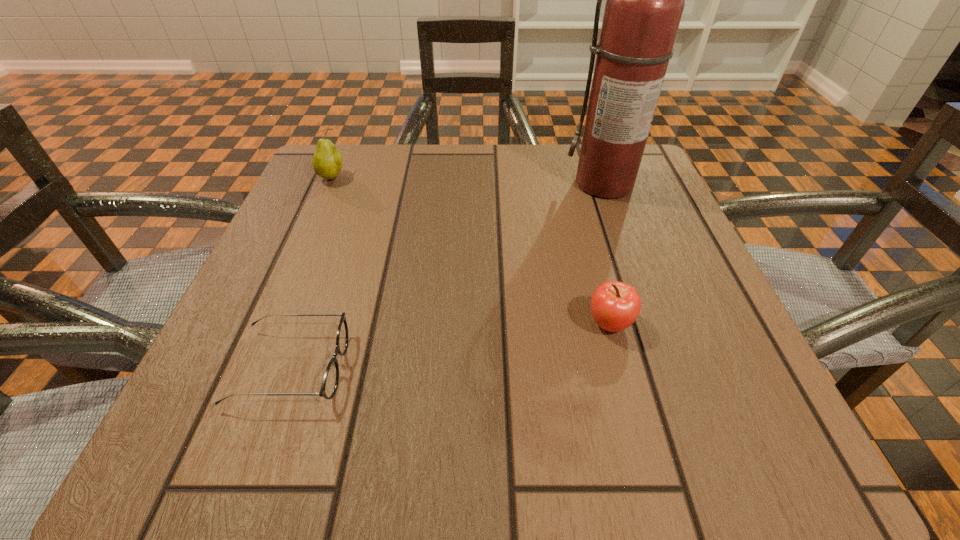
The image size is (960, 540). I want to click on vacant space that is in between the shortest object and the fire extinguisher, so click(x=448, y=275).

This screenshot has height=540, width=960. Identify the location of free space between the second tallest object and the shortest object. (312, 273).

Locate an element on the screen. The width and height of the screenshot is (960, 540). free spot between the apple and the spectacles is located at coordinates (450, 346).

Where is `free spot between the spectacles and the pear`? This screenshot has height=540, width=960. free spot between the spectacles and the pear is located at coordinates (312, 273).

Where is `the third closest object to the apple`? This screenshot has width=960, height=540. the third closest object to the apple is located at coordinates (327, 161).

Find the location of a particular element. the third closest object to the second shortest object is located at coordinates (327, 161).

Locate an element on the screen. This screenshot has width=960, height=540. free space that satisfies the following two spatial constraints: 1. on the front-facing side of the fire extinguisher; 2. through the lenses of the shortest object is located at coordinates (673, 368).

Find the location of a particular element. This screenshot has width=960, height=540. free spot that satisfies the following two spatial constraints: 1. on the front-facing side of the fire extinguisher; 2. through the lenses of the shortest object is located at coordinates (673, 368).

Locate an element on the screen. free location that satisfies the following two spatial constraints: 1. on the front-facing side of the fire extinguisher; 2. through the lenses of the shortest object is located at coordinates (673, 368).

You are a GUI agent. You are given a task and a screenshot of the screen. Output one action in this format:
    pyautogui.click(x=<x>, y=<y>)
    Task: Click on the free space that satisfies the following two spatial constraints: 1. on the front-facing side of the tallest object; 2. through the lenses of the shortest object
    
    Given the screenshot: What is the action you would take?
    pyautogui.click(x=673, y=368)